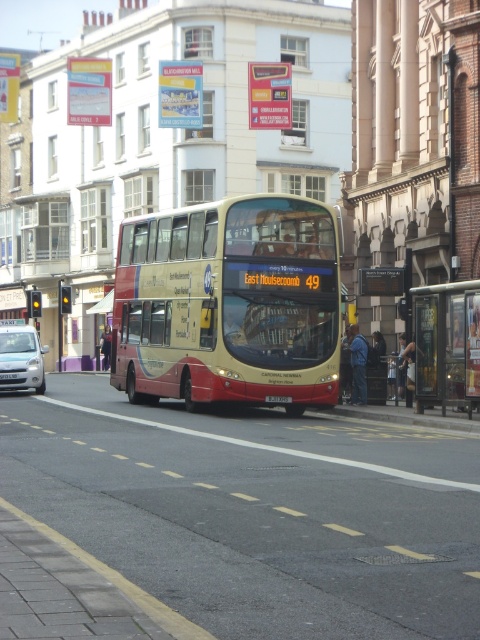
You are a city planner analyzing the street layout. The beige metallic bus at center is currently parked at the metallic bus stop at right. If another bus arrives, will there be enough space for it to pull over without blocking traffic?

The beige metallic bus at center might be wider than the metallic bus stop at right, so there may not be sufficient space for another bus to pull over without potentially blocking traffic.

You are a pedestrian standing in the middle of the street. You see the metallic bus stop at right and the silver metallic car at left. Which object takes up more space in the image?

The silver metallic car at left takes up more space in the image than the metallic bus stop at right because the metallic bus stop at right occupies less space than silver metallic car at left.

You are a pedestrian trying to cross the street. You see a beige metallic bus at center and a silver metallic car at left. Which vehicle should you be more cautious of when crossing, considering their sizes?

The beige metallic bus at center is larger in size than the silver metallic car at left, so you should be more cautious of the beige metallic bus at center when crossing the street.